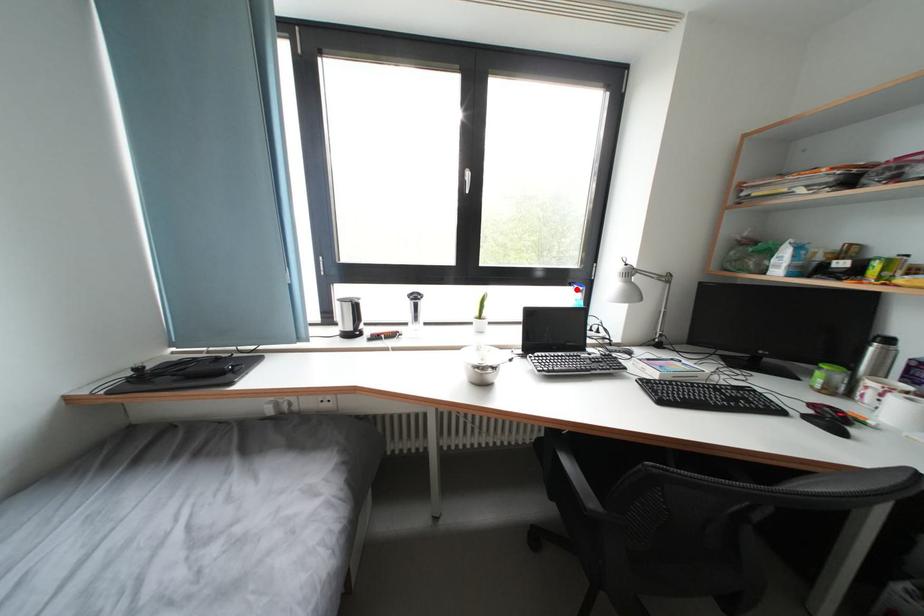
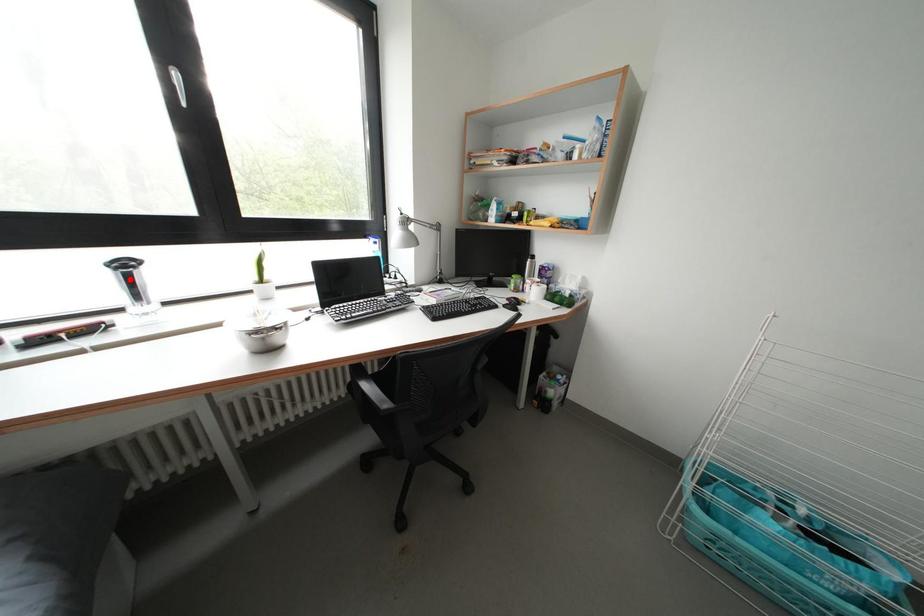
I am providing you with two images of the same scene from different viewpoints. A red point is marked on the first image and another point is marked on the second image. Is the marked point in image1 the same physical position as the marked point in image2?

No